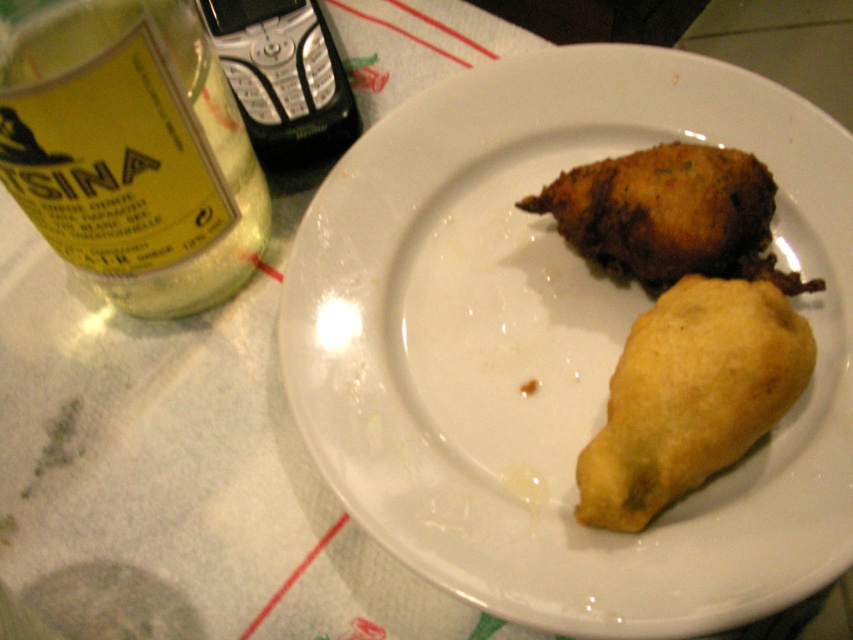
Which is behind, point (650, 452) or point (608, 248)?

Positioned behind is point (608, 248).

Where is `golden crispy pastry at center`? The width and height of the screenshot is (853, 640). golden crispy pastry at center is located at coordinates (691, 396).

Is point (698, 320) positioned after point (740, 163)?

No.

You are a GUI agent. You are given a task and a screenshot of the screen. Output one action in this format:
    pyautogui.click(x=<x>, y=<y>)
    Task: Click on the golden crispy pastry at center
    Image resolution: width=853 pixels, height=640 pixels.
    Given the screenshot: What is the action you would take?
    691,396

Locate an element on the screen. This screenshot has height=640, width=853. golden-brown fried food at center is located at coordinates (558, 348).

I want to click on golden-brown fried food at center, so click(558, 348).

Is translucent glass bottle at upper left above golden crispy pastry at center?

Yes.

Which is in front, point (193, 282) or point (654, 340)?

Point (654, 340) is in front.

Locate an element on the screen. The height and width of the screenshot is (640, 853). translucent glass bottle at upper left is located at coordinates (131, 150).